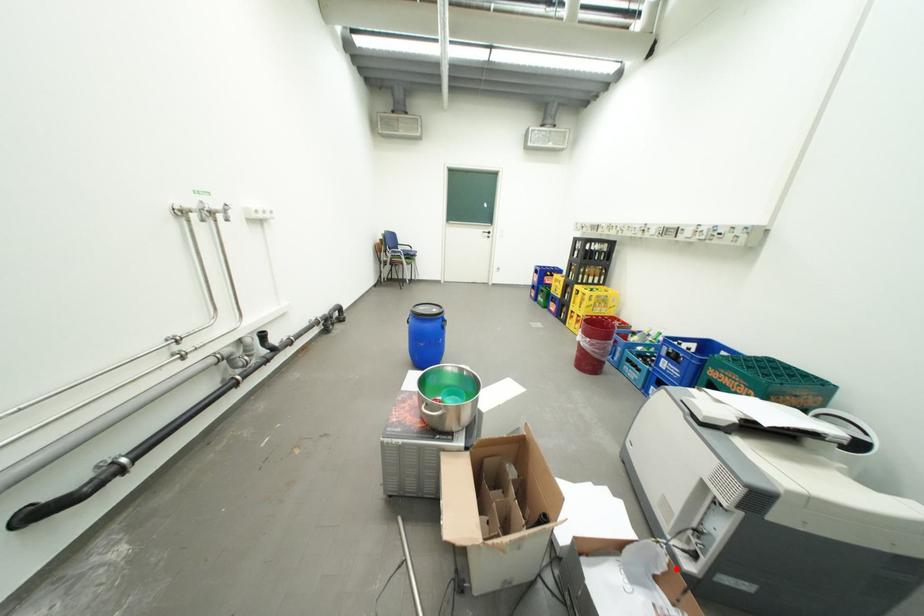
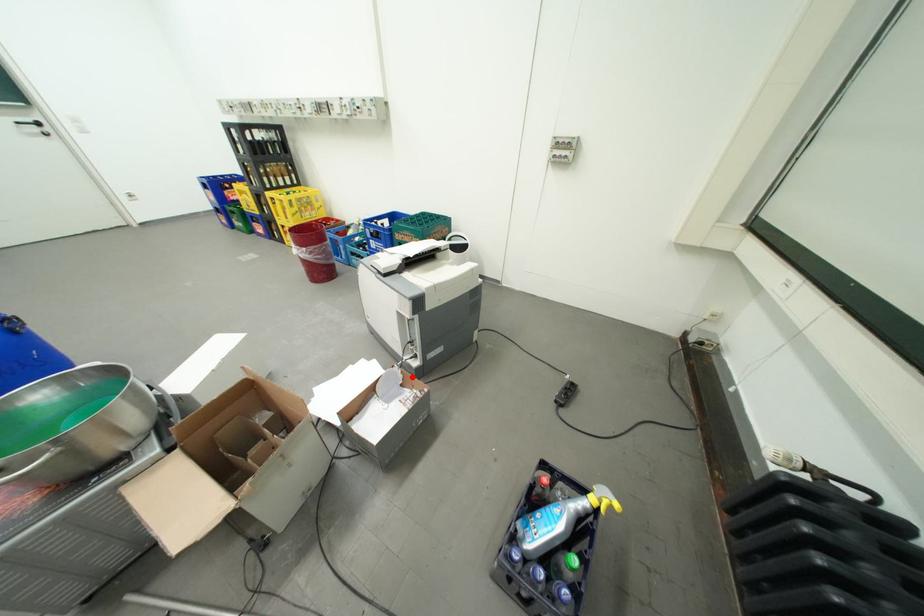
I am providing you with two images of the same scene from different viewpoints. A red point is marked on the first image and another point is marked on the second image. Do the highlighted points in image1 and image2 indicate the same real-world spot?

Yes